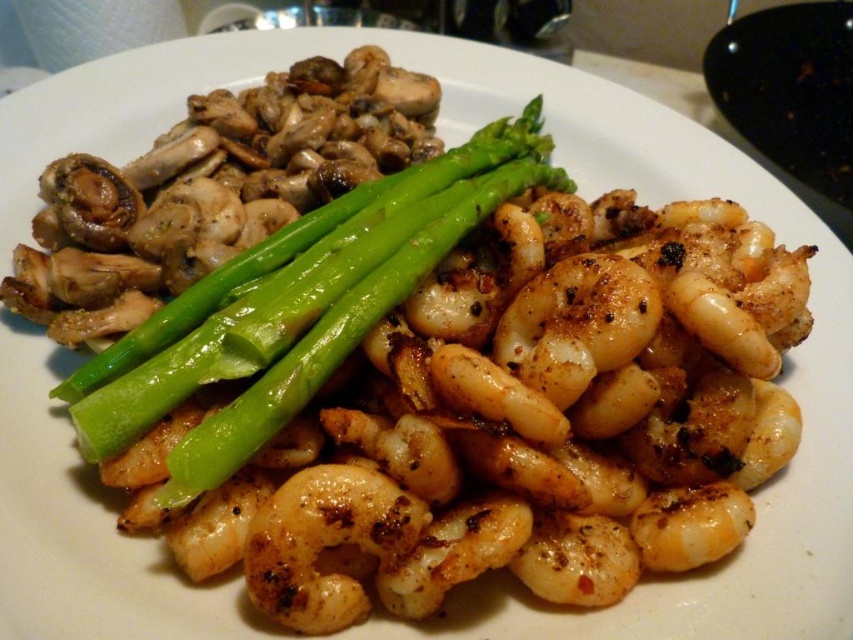
Does green glossy asparagus at center lie behind glossy white shrimp at center?

No, green glossy asparagus at center is in front of glossy white shrimp at center.

Can you confirm if green glossy asparagus at center is taller than glossy white shrimp at center?

Indeed, green glossy asparagus at center has a greater height compared to glossy white shrimp at center.

I want to click on green glossy asparagus at center, so click(x=309, y=307).

The image size is (853, 640). Find the location of `green glossy asparagus at center`. green glossy asparagus at center is located at coordinates (309, 307).